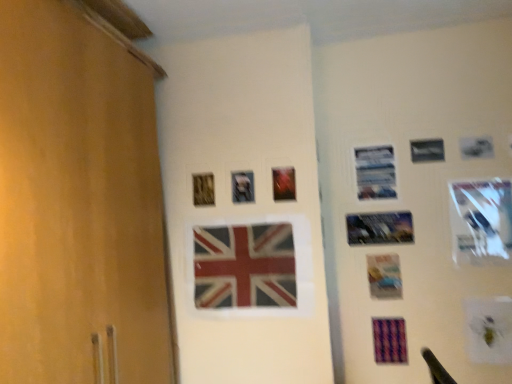
Question: In terms of height, does metallic reflective photo frame at center-right, acting as the 5th picture frame starting from the left, look taller or shorter compared to metallic silver picture frame at upper right, marked as the 4th picture frame in a right-to-left arrangement?

Choices:
 (A) short
 (B) tall

Answer: (A)

Question: Considering the relative positions of metallic reflective photo frame at center-right, acting as the 5th picture frame starting from the left, and metallic silver picture frame at upper right, marked as the 4th picture frame in a right-to-left arrangement, in the image provided, is metallic reflective photo frame at center-right, acting as the 5th picture frame starting from the left, to the left or to the right of metallic silver picture frame at upper right, marked as the 4th picture frame in a right-to-left arrangement,?

Choices:
 (A) left
 (B) right

Answer: (B)

Question: Considering the real-world distances, which object is closest to the matte plastic flag at center?

Choices:
 (A) metallic reflective photo frame at upper center, arranged as the fifth picture frame when viewed from the right
 (B) metallic silver picture frame at center, placed as the 2th picture frame when sorted from left to right
 (C) metallic reflective photo frame at center-right, which ranks as the third picture frame in right-to-left order
 (D) metallic silver picture frame at upper right, which appears as the sixth picture frame when viewed from the left
 (E) metallic silver picture frame at upper right, marked as the 4th picture frame in a right-to-left arrangement

Answer: (B)

Question: Estimate the real-world distances between objects in this image. Which object is closer to the metallic silver picture frame at center, positioned as the sixth picture frame in right-to-left order?

Choices:
 (A) metallic reflective photo frame at upper center, the third picture frame when ordered from left to right
 (B) metallic silver picture frame at upper right, which is the first picture frame from right to left
 (C) matte plastic flag at center
 (D) metallic silver picture frame at upper right, which appears as the sixth picture frame when viewed from the left
 (E) wooden picture frame at upper center, which ranks as the seventh picture frame in right-to-left order

Answer: (E)